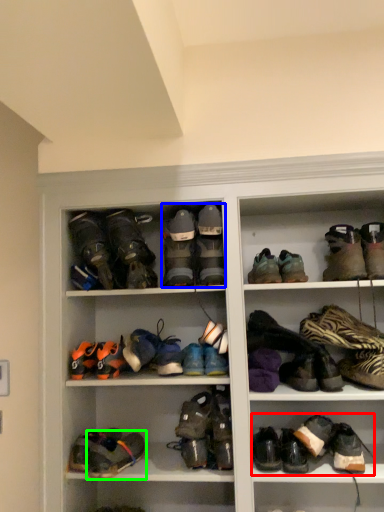
Question: Which object is positioned closest to footwear (highlighted by a red box)? Select from footwear (highlighted by a blue box) and footwear (highlighted by a green box).

Choices:
 (A) footwear
 (B) footwear

Answer: (B)